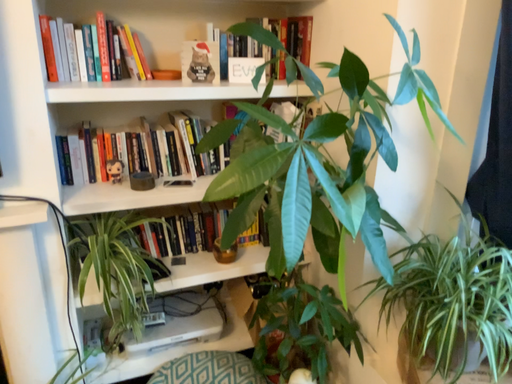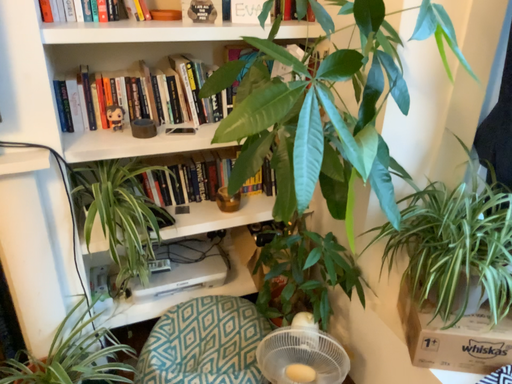
Question: How did the camera likely rotate when shooting the video?

Choices:
 (A) rotated upward
 (B) rotated downward

Answer: (B)